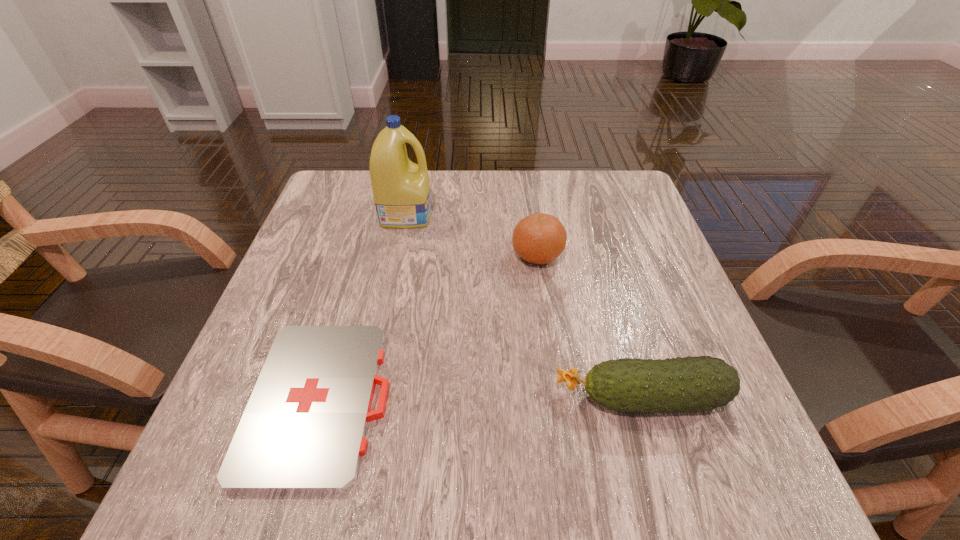
The height and width of the screenshot is (540, 960). Find the location of `the farthest object`. the farthest object is located at coordinates (401, 189).

Identify the location of the tallest object. This screenshot has width=960, height=540. (401, 189).

This screenshot has width=960, height=540. I want to click on the third nearest object, so click(x=540, y=238).

Where is `cucumber`? cucumber is located at coordinates (702, 383).

Image resolution: width=960 pixels, height=540 pixels. I want to click on the first-aid kit, so click(303, 430).

Identify the location of free space located 0.160m on the label of the tallest object. (496, 213).

The width and height of the screenshot is (960, 540). In order to click on free spot located 0.110m on the front of the clementine in this screenshot , I will do `click(545, 312)`.

Identify the location of vacant space located 0.190m at the blossom end of the third tallest object. (439, 397).

Locate an element on the screen. Image resolution: width=960 pixels, height=540 pixels. vacant space located at the blossom end of the third tallest object is located at coordinates (335, 397).

This screenshot has width=960, height=540. In order to click on vacant space located 0.280m at the blossom end of the third tallest object in this screenshot , I will do `click(384, 397)`.